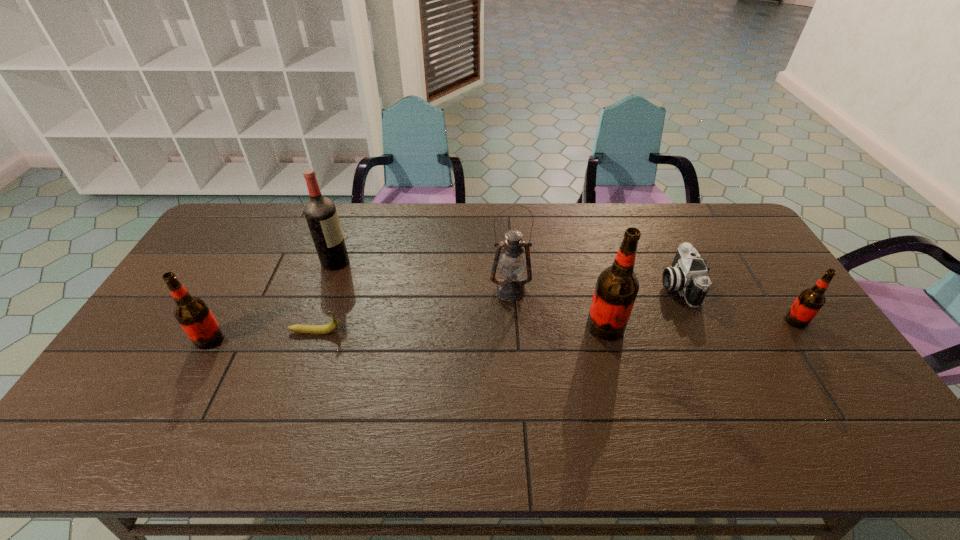
Locate an element on the screen. the leftmost object is located at coordinates (192, 313).

The width and height of the screenshot is (960, 540). I want to click on the leftmost root beer, so click(x=192, y=313).

Identify the location of the tallest root beer. (616, 289).

Locate an element on the screen. the second root beer from right to left is located at coordinates (616, 289).

The height and width of the screenshot is (540, 960). Find the location of `the fifth tallest object`. the fifth tallest object is located at coordinates (809, 302).

You are a GUI agent. You are given a task and a screenshot of the screen. Output one action in this format:
    pyautogui.click(x=<x>, y=<y>)
    Task: Click on the rightmost root beer
    
    Given the screenshot: What is the action you would take?
    pyautogui.click(x=809, y=302)

Identify the location of liquor. This screenshot has width=960, height=540. (320, 212).

Identify the location of the shortest object. (332, 326).

Image resolution: width=960 pixels, height=540 pixels. What are the coordinates of `camera` in the screenshot? It's located at (688, 275).

You are a GUI agent. You are given a task and a screenshot of the screen. Output one action in this format:
    pyautogui.click(x=<x>, y=<y>)
    Task: Click on the second object from right to left
    This screenshot has height=540, width=960.
    Given the screenshot: What is the action you would take?
    pyautogui.click(x=688, y=275)